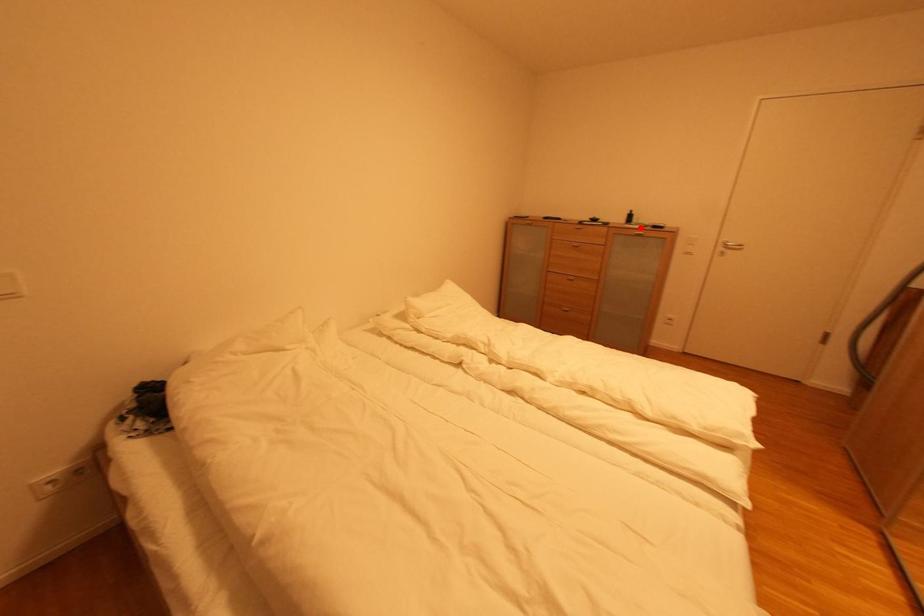
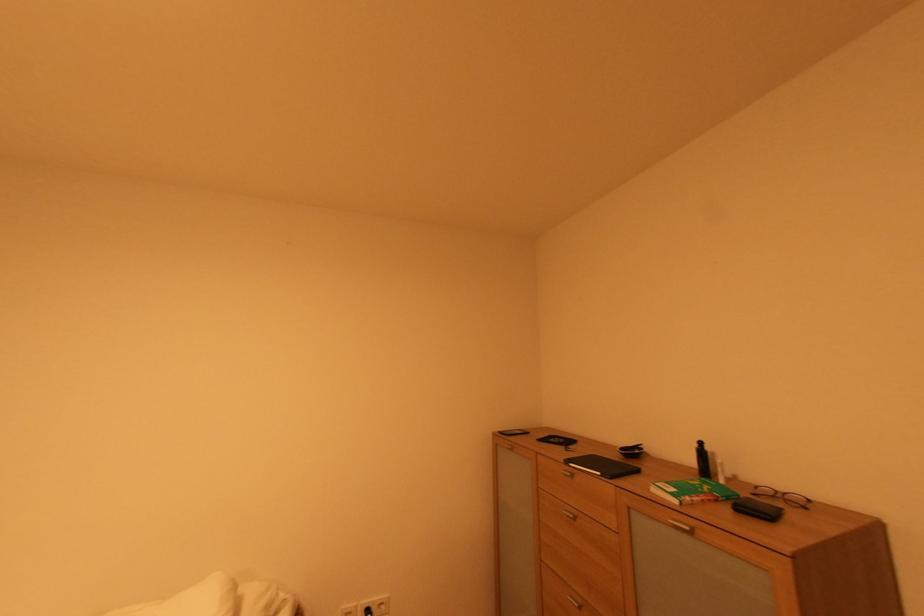
Locate, in the second image, the point that corresponds to the highlighted location in the first image.

(682, 503)